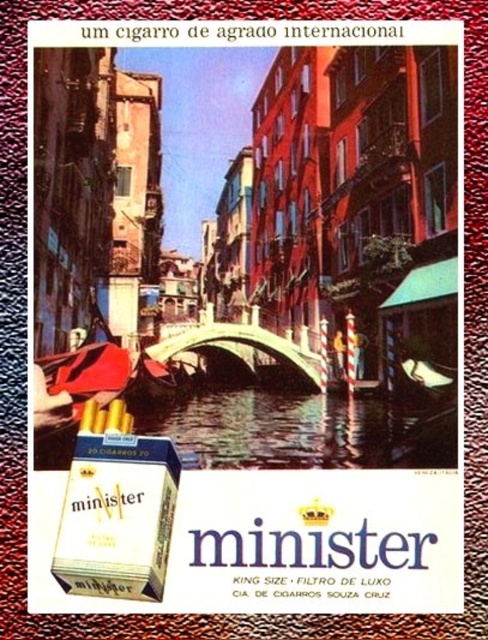
Question: Does clear water at center appear under white matte cigarette box at lower left?

Choices:
 (A) yes
 (B) no

Answer: (B)

Question: Which point is farther to the camera?

Choices:
 (A) white matte cigarette box at lower left
 (B) clear water at center

Answer: (B)

Question: Is clear water at center bigger than white matte cigarette box at lower left?

Choices:
 (A) no
 (B) yes

Answer: (B)

Question: Is clear water at center wider than white matte cigarette box at lower left?

Choices:
 (A) yes
 (B) no

Answer: (A)